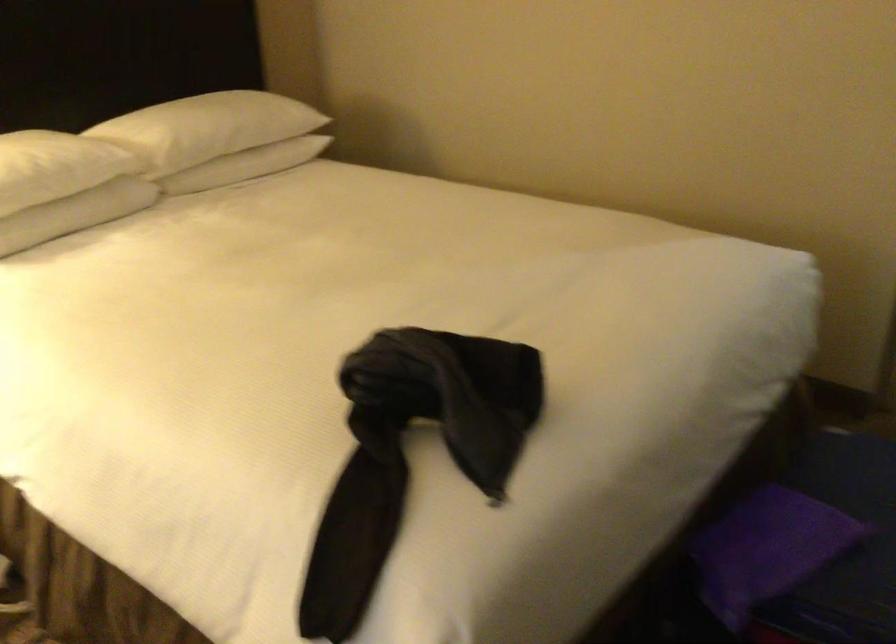
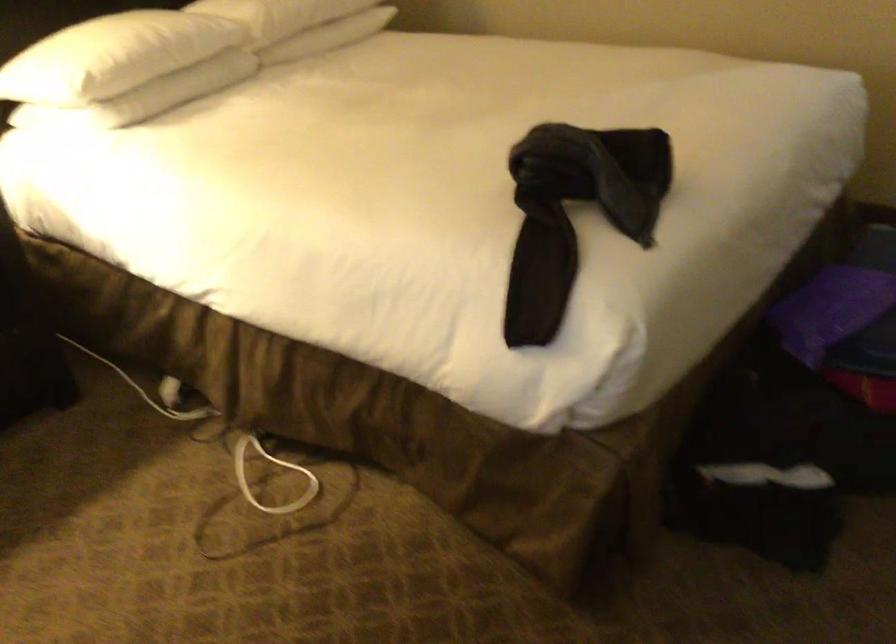
Locate, in the second image, the point that corresponds to point (754, 552) in the first image.

(831, 310)